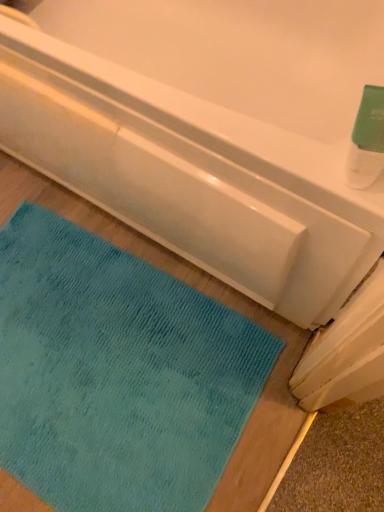
Question: In terms of height, does teal plush mat at lower left look taller or shorter compared to green matte bottle at upper right?

Choices:
 (A) short
 (B) tall

Answer: (A)

Question: Based on their sizes in the image, would you say teal plush mat at lower left is bigger or smaller than green matte bottle at upper right?

Choices:
 (A) big
 (B) small

Answer: (A)

Question: Based on their relative distances, which object is farther from the matte white bathtub at upper center?

Choices:
 (A) green matte bottle at upper right
 (B) teal plush mat at lower left

Answer: (A)

Question: Which object is the farthest from the teal plush mat at lower left?

Choices:
 (A) matte white bathtub at upper center
 (B) green matte bottle at upper right

Answer: (B)